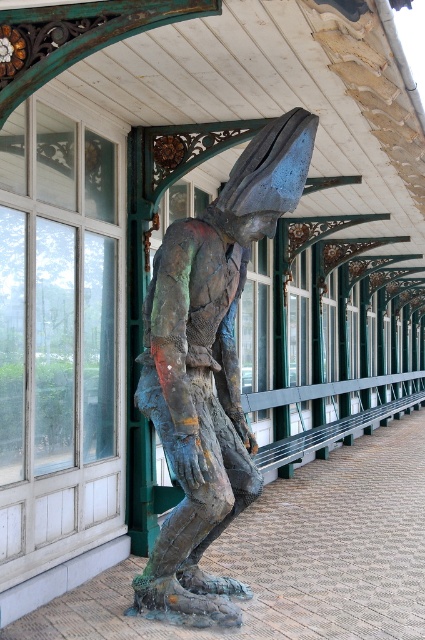
You are an art conservator examining the sculpture. You notice two bronze elements, the bronze textured figure at center and the bronze statue at center. Which one is placed on top of the other?

The bronze textured figure at center is positioned over the bronze statue at center.